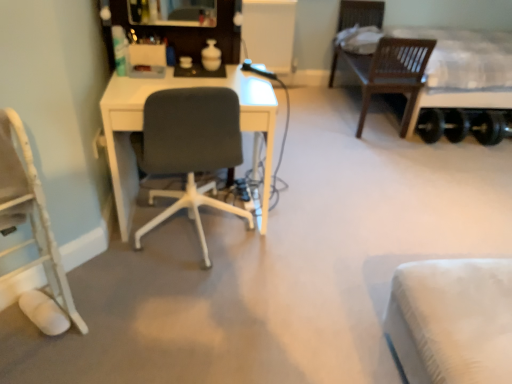
Locate an element on the screen. The height and width of the screenshot is (384, 512). free spot below white fabric chair at lower left, the 2th chair when ordered from right to left (from a real-world perspective) is located at coordinates (31, 344).